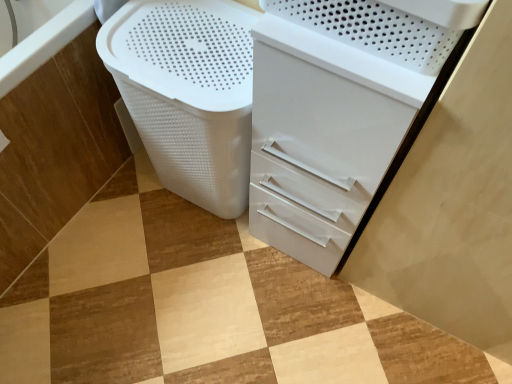
Question: Visually, is white plastic laundry basket at lower left positioned to the left or to the right of white glossy file cabinet at center?

Choices:
 (A) left
 (B) right

Answer: (A)

Question: Is white plastic laundry basket at lower left taller or shorter than white glossy file cabinet at center?

Choices:
 (A) tall
 (B) short

Answer: (B)

Question: Estimate the real-world distances between objects in this image. Which object is farther from the white plastic laundry basket at lower left?

Choices:
 (A) white plastic basket at lower left
 (B) white glossy file cabinet at center

Answer: (A)

Question: Which is farther from the white glossy file cabinet at center?

Choices:
 (A) white plastic basket at lower left
 (B) white plastic laundry basket at lower left

Answer: (A)